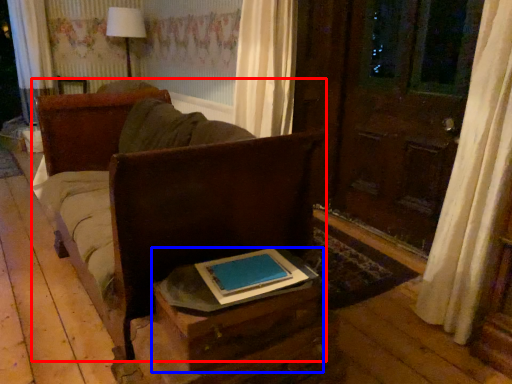
Question: Among these objects, which one is nearest to the camera, furniture (highlighted by a red box) or table (highlighted by a blue box)?

Choices:
 (A) furniture
 (B) table

Answer: (B)